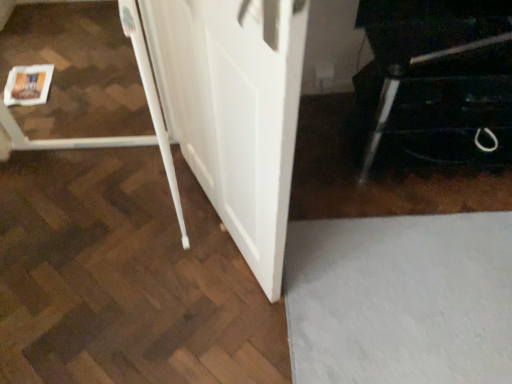
Question: Does black glossy cabinet at lower right appear on the right side of white matte barn door at center?

Choices:
 (A) no
 (B) yes

Answer: (B)

Question: From the image's perspective, is black glossy cabinet at lower right on top of white matte barn door at center?

Choices:
 (A) no
 (B) yes

Answer: (B)

Question: Considering the relative positions of black glossy cabinet at lower right and white matte barn door at center in the image provided, is black glossy cabinet at lower right to the left of white matte barn door at center from the viewer's perspective?

Choices:
 (A) no
 (B) yes

Answer: (A)

Question: Considering the relative positions of black glossy cabinet at lower right and white matte barn door at center in the image provided, is black glossy cabinet at lower right behind white matte barn door at center?

Choices:
 (A) no
 (B) yes

Answer: (B)

Question: Is black glossy cabinet at lower right facing away from white matte barn door at center?

Choices:
 (A) no
 (B) yes

Answer: (A)

Question: Would you say black glossy cabinet at lower right is a long distance from white matte barn door at center?

Choices:
 (A) yes
 (B) no

Answer: (B)

Question: Is white matte barn door at center to the right of black glossy cabinet at lower right from the viewer's perspective?

Choices:
 (A) no
 (B) yes

Answer: (A)

Question: Is white matte barn door at center closer to the viewer compared to black glossy cabinet at lower right?

Choices:
 (A) yes
 (B) no

Answer: (A)

Question: Can you confirm if white matte barn door at center is bigger than black glossy cabinet at lower right?

Choices:
 (A) no
 (B) yes

Answer: (A)

Question: Could you tell me if white matte barn door at center is turned towards black glossy cabinet at lower right?

Choices:
 (A) yes
 (B) no

Answer: (B)

Question: Is white matte barn door at center turned away from black glossy cabinet at lower right?

Choices:
 (A) no
 (B) yes

Answer: (B)

Question: Considering the relative sizes of white matte barn door at center and black glossy cabinet at lower right in the image provided, is white matte barn door at center taller than black glossy cabinet at lower right?

Choices:
 (A) no
 (B) yes

Answer: (B)

Question: From the image's perspective, relative to white matte barn door at center, is black glossy cabinet at lower right above or below?

Choices:
 (A) above
 (B) below

Answer: (A)